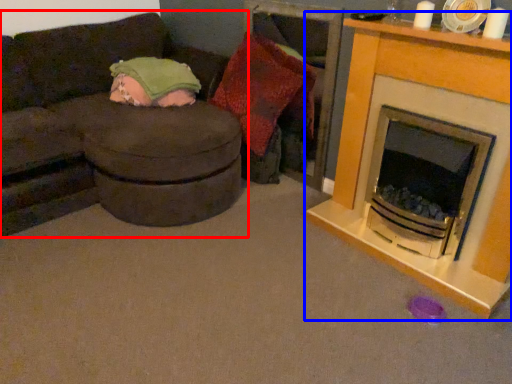
Question: Which point is closer to the camera, studio couch (highlighted by a red box) or fireplace (highlighted by a blue box)?

Choices:
 (A) studio couch
 (B) fireplace

Answer: (A)